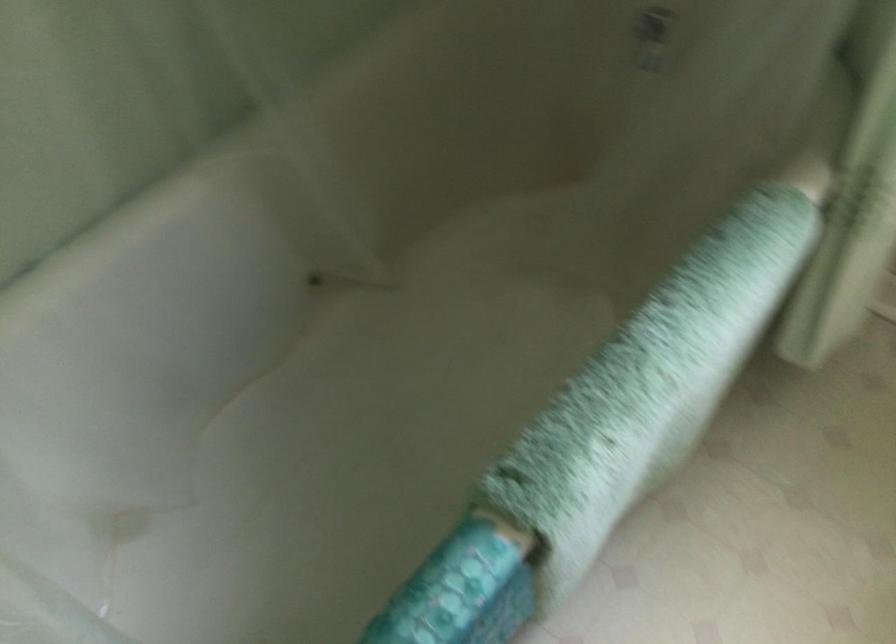
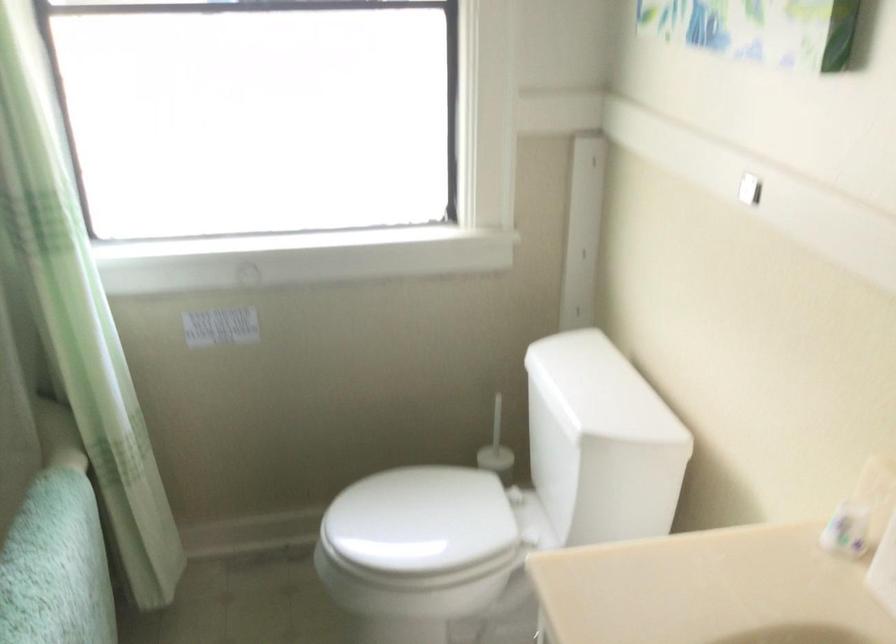
Question: The first image is from the beginning of the video and the second image is from the end. How did the camera likely rotate when shooting the video?

Choices:
 (A) Left
 (B) Right
 (C) Up
 (D) Down

Answer: (B)